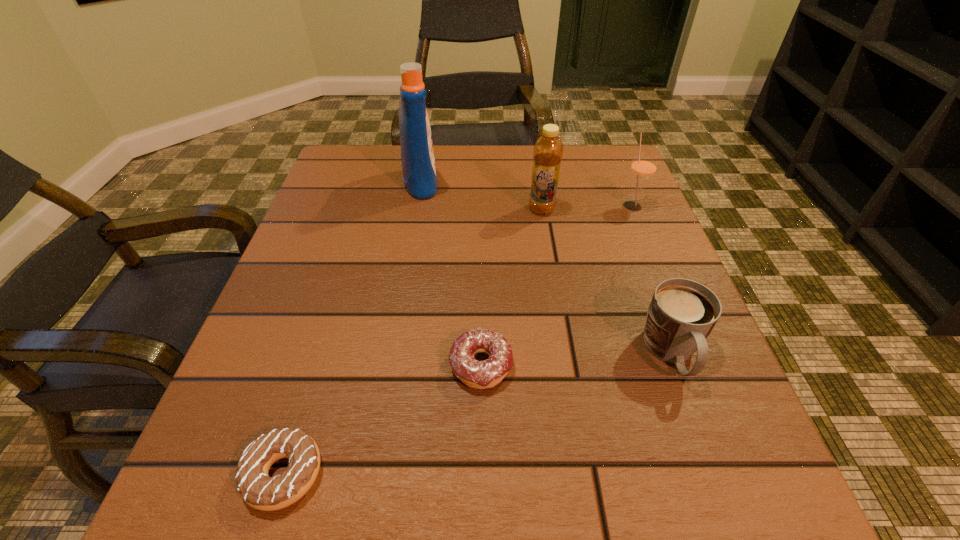
Find the location of a particular element. vacant area that lies between the detergent and the bottle is located at coordinates (481, 196).

You are a GUI agent. You are given a task and a screenshot of the screen. Output one action in this format:
    pyautogui.click(x=<x>, y=<y>)
    Task: Click on the second closest object to the nearest object
    Image resolution: width=960 pixels, height=540 pixels.
    Given the screenshot: What is the action you would take?
    pyautogui.click(x=682, y=313)

This screenshot has height=540, width=960. What are the coordinates of `the second closest object to the left doughnut` in the screenshot? It's located at (682, 313).

At what (x,y) coordinates should I click in order to perform the action: click on free region that satisfies the following two spatial constraints: 1. on the label of the fifth object from right to left; 2. on the back side of the straw. Please return your answer as a coordinate pair (x, y). The image size is (960, 540). Looking at the image, I should click on (417, 205).

The height and width of the screenshot is (540, 960). What are the coordinates of `vacant point that satisfies the following two spatial constraints: 1. on the back side of the farther doughnut; 2. on the label of the tallest object` in the screenshot? It's located at (480, 183).

At what (x,y) coordinates should I click in order to perform the action: click on vacant space that satisfies the following two spatial constraints: 1. on the back side of the bottle; 2. on the right side of the third tallest object. Please return your answer as a coordinate pair (x, y). The image size is (960, 540). Looking at the image, I should click on (540, 205).